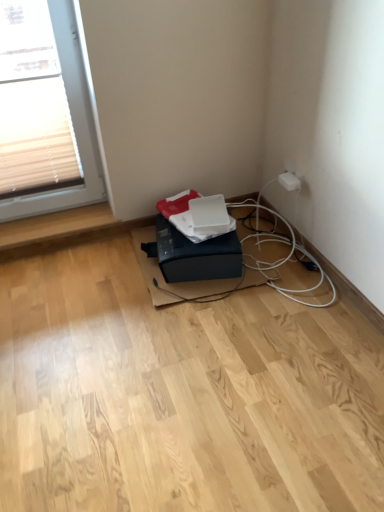
Question: From their relative heights in the image, would you say black matte printer at lower center is taller or shorter than white plastic electric outlet at upper right?

Choices:
 (A) tall
 (B) short

Answer: (A)

Question: Relative to white plastic electric outlet at upper right, is black matte printer at lower center in front or behind?

Choices:
 (A) behind
 (B) front

Answer: (B)

Question: Would you say black matte printer at lower center is inside or outside white plastic electric outlet at upper right?

Choices:
 (A) outside
 (B) inside

Answer: (A)

Question: Considering the positions of white plastic electric outlet at upper right and black matte printer at lower center in the image, is white plastic electric outlet at upper right wider or thinner than black matte printer at lower center?

Choices:
 (A) thin
 (B) wide

Answer: (A)

Question: Visually, is white plastic electric outlet at upper right positioned to the left or to the right of black matte printer at lower center?

Choices:
 (A) right
 (B) left

Answer: (A)

Question: Considering the positions of white plastic electric outlet at upper right and black matte printer at lower center in the image, is white plastic electric outlet at upper right taller or shorter than black matte printer at lower center?

Choices:
 (A) short
 (B) tall

Answer: (A)

Question: Which is correct: white plastic electric outlet at upper right is inside black matte printer at lower center, or outside of it?

Choices:
 (A) inside
 (B) outside

Answer: (B)